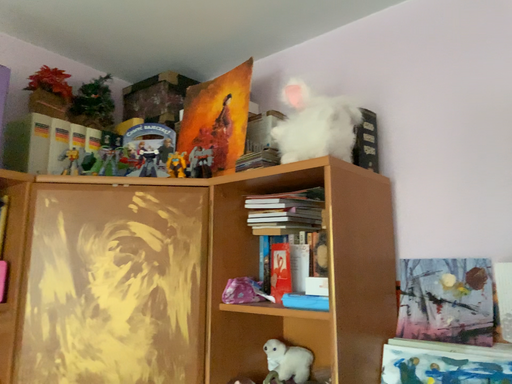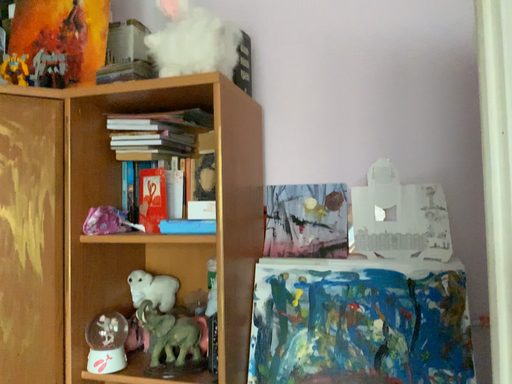
Question: Which way did the camera rotate in the video?

Choices:
 (A) rotated upward
 (B) rotated downward

Answer: (B)